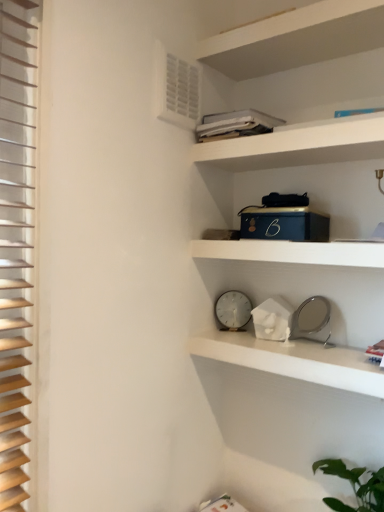
Question: From the image's perspective, is white matte clock at center, positioned as the first shelf in top-to-bottom order, on white marble clock at center, the second shelf in the top-to-bottom sequence?

Choices:
 (A) no
 (B) yes

Answer: (B)

Question: Is the position of white matte clock at center, which is the second shelf from bottom to top, less distant than that of white marble clock at center, the first shelf when ordered from bottom to top?

Choices:
 (A) no
 (B) yes

Answer: (B)

Question: From a real-world perspective, is white matte clock at center, positioned as the first shelf in top-to-bottom order, on top of white marble clock at center, the second shelf in the top-to-bottom sequence?

Choices:
 (A) yes
 (B) no

Answer: (A)

Question: Considering the relative sizes of white matte clock at center, positioned as the first shelf in top-to-bottom order, and white marble clock at center, the second shelf in the top-to-bottom sequence, in the image provided, is white matte clock at center, positioned as the first shelf in top-to-bottom order, taller than white marble clock at center, the second shelf in the top-to-bottom sequence,?

Choices:
 (A) yes
 (B) no

Answer: (B)

Question: Is white marble clock at center, the second shelf in the top-to-bottom sequence, completely or partially inside white matte clock at center, which is the second shelf from bottom to top?

Choices:
 (A) yes
 (B) no

Answer: (B)

Question: Can you confirm if white matte clock at center, which is the second shelf from bottom to top, is thinner than white marble clock at center, the first shelf when ordered from bottom to top?

Choices:
 (A) yes
 (B) no

Answer: (A)

Question: Is the depth of white matte cabinet at upper center greater than that of white plastic air conditioning unit at upper left?

Choices:
 (A) yes
 (B) no

Answer: (B)

Question: Is white plastic air conditioning unit at upper left located within white matte cabinet at upper center?

Choices:
 (A) no
 (B) yes

Answer: (A)

Question: From a real-world perspective, is white matte cabinet at upper center below white plastic air conditioning unit at upper left?

Choices:
 (A) no
 (B) yes

Answer: (B)

Question: From a real-world perspective, does white matte cabinet at upper center stand above white plastic air conditioning unit at upper left?

Choices:
 (A) yes
 (B) no

Answer: (B)

Question: Is white matte cabinet at upper center shorter than white plastic air conditioning unit at upper left?

Choices:
 (A) yes
 (B) no

Answer: (A)

Question: Is white matte cabinet at upper center thinner than white plastic air conditioning unit at upper left?

Choices:
 (A) no
 (B) yes

Answer: (A)

Question: Can you confirm if white matte clock at center, positioned as the first shelf in top-to-bottom order, is smaller than white plastic clock at center?

Choices:
 (A) no
 (B) yes

Answer: (A)